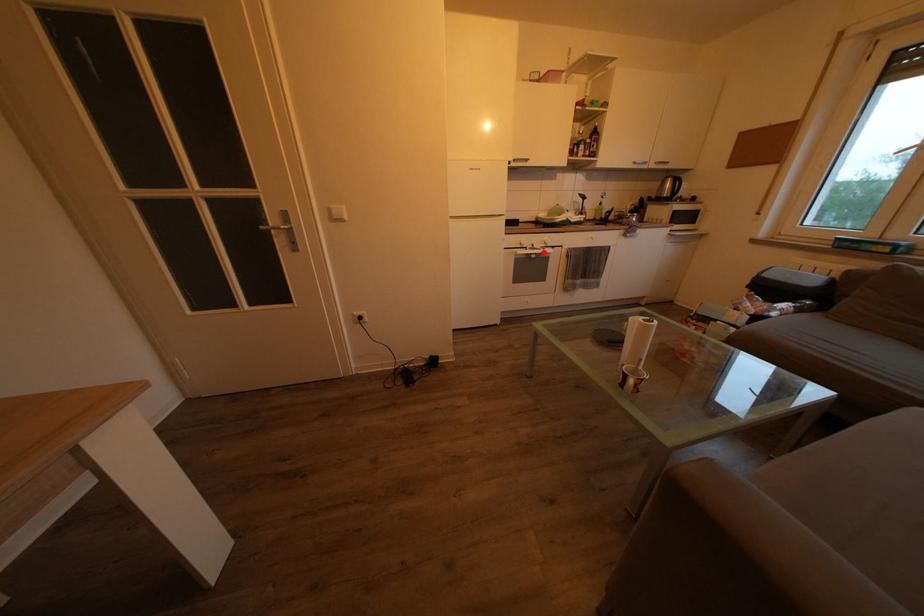
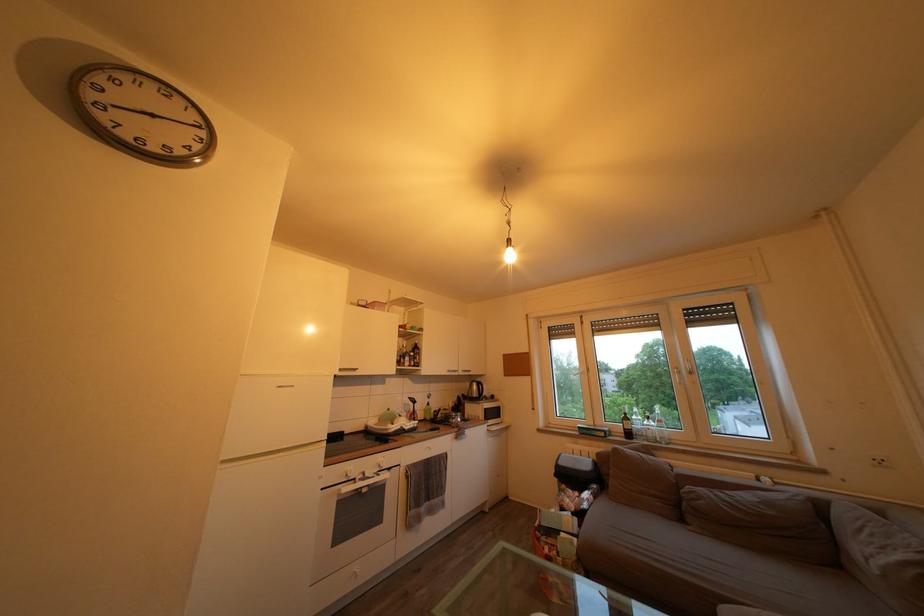
Question: I am providing you with two images of the same scene from different viewpoints. A red point is shown in image1. For the corresponding object point in image2, is it positioned nearer or farther from the camera?

Choices:
 (A) Nearer
 (B) Farther

Answer: (B)